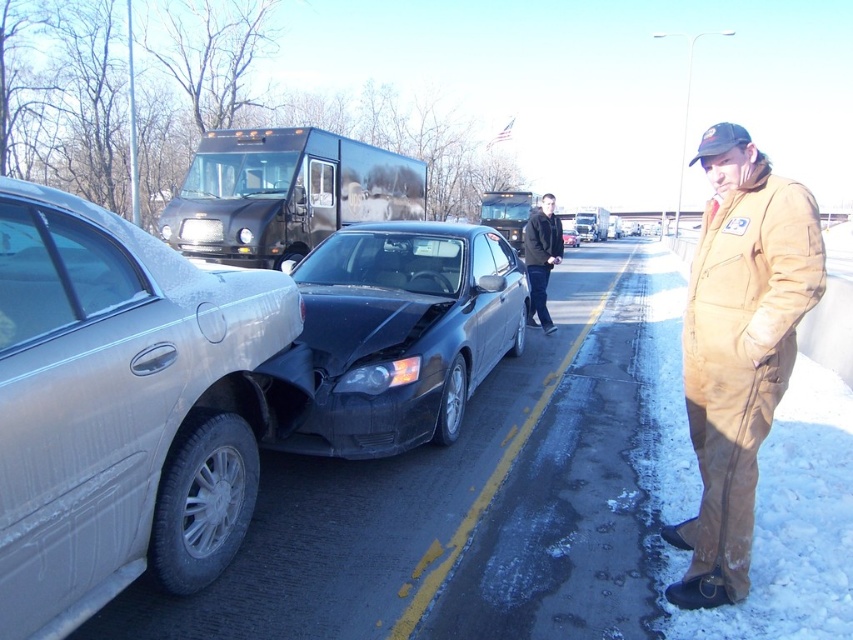
Question: Which object is farther from the camera taking this photo?

Choices:
 (A) black matte sedan at center
 (B) dark blue jacket at center
 (C) satin silver sedan at left

Answer: (B)

Question: Is dark blue jacket at center thinner than black matte sedan at center?

Choices:
 (A) yes
 (B) no

Answer: (A)

Question: Which point appears closest to the camera in this image?

Choices:
 (A) (357, 384)
 (B) (125, 465)

Answer: (B)

Question: Among these objects, which one is nearest to the camera?

Choices:
 (A) dark blue jacket at center
 (B) black matte car at center
 (C) satin silver sedan at left
 (D) brown corduroy jumpsuit at right

Answer: (C)

Question: Does satin silver sedan at left have a larger size compared to brown corduroy jumpsuit at right?

Choices:
 (A) yes
 (B) no

Answer: (B)

Question: Is the position of black matte car at center less distant than that of black matte sedan at center?

Choices:
 (A) no
 (B) yes

Answer: (B)